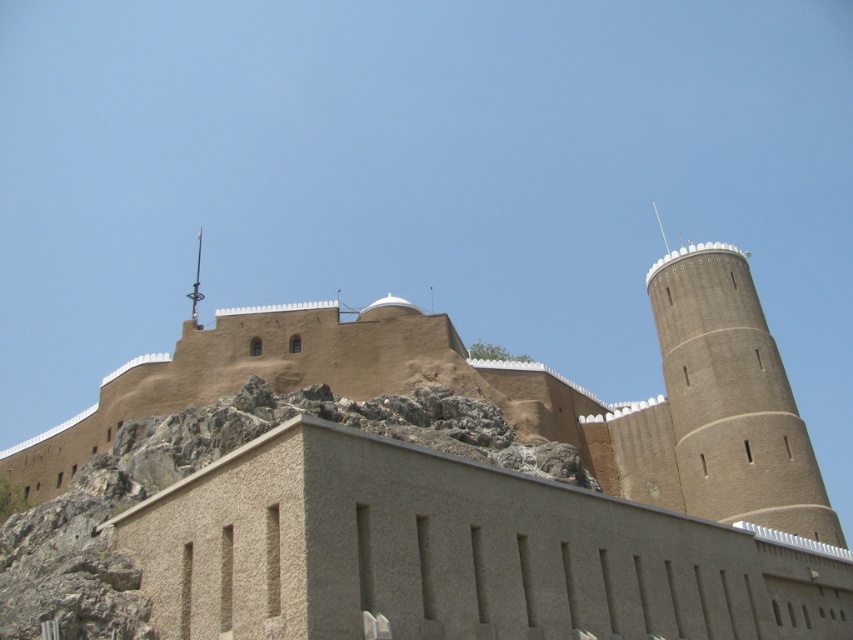
Question: Is brown textured castle at center further to the viewer compared to brown textured tower at right?

Choices:
 (A) yes
 (B) no

Answer: (B)

Question: Which object is closer to the camera taking this photo?

Choices:
 (A) brown textured castle at center
 (B) brown textured tower at right

Answer: (A)

Question: Is brown textured castle at center closer to the viewer compared to brown textured tower at right?

Choices:
 (A) no
 (B) yes

Answer: (B)

Question: Does brown textured castle at center appear on the right side of brown textured tower at right?

Choices:
 (A) yes
 (B) no

Answer: (B)